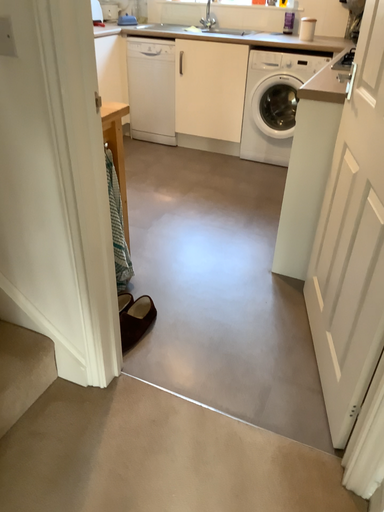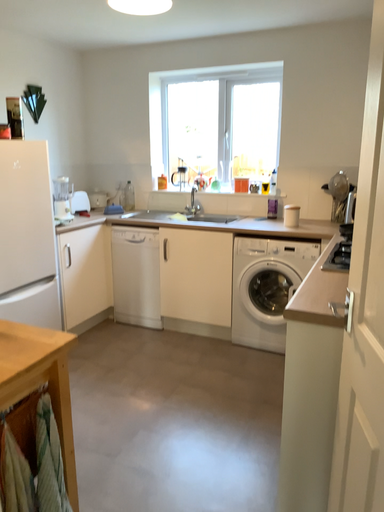
Question: Which way did the camera rotate in the video?

Choices:
 (A) rotated downward
 (B) rotated upward

Answer: (B)